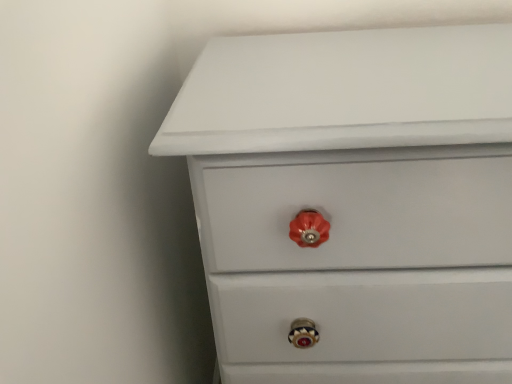
Find the location of a particular element. This screenshot has width=512, height=384. vacant area on top of white glossy chest of drawers at upper center (from a real-world perspective) is located at coordinates (366, 62).